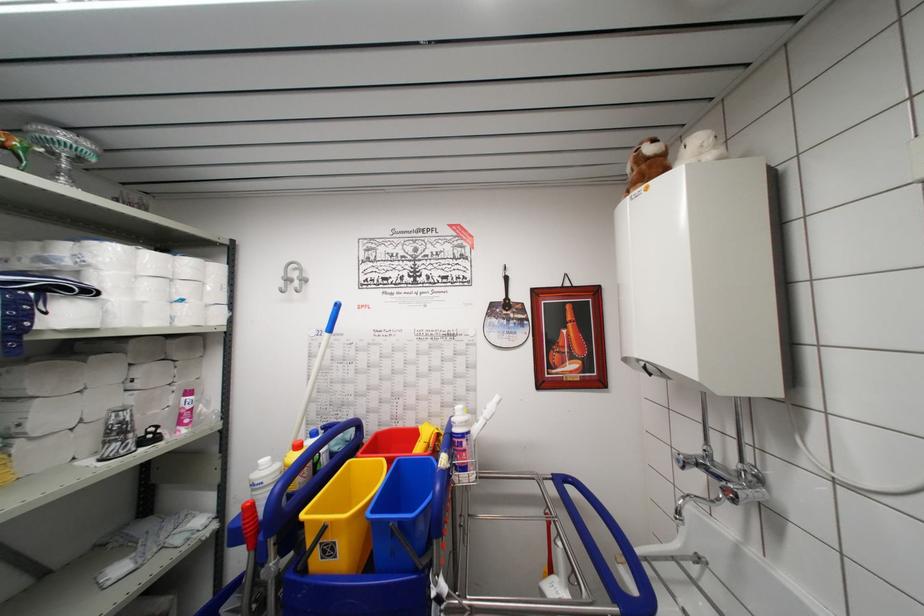
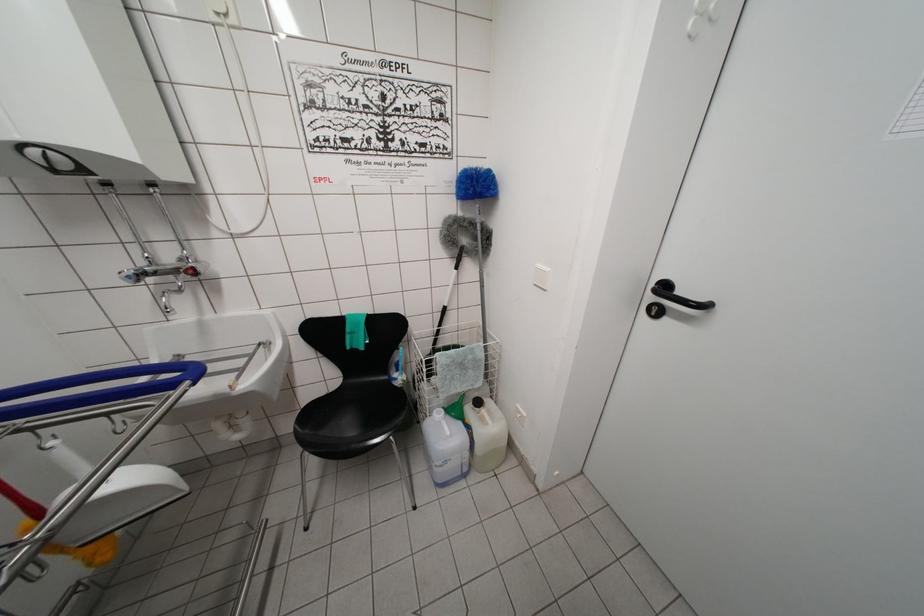
The point at (x=682, y=464) is marked in the first image. Where is the corresponding point in the second image?

(131, 282)